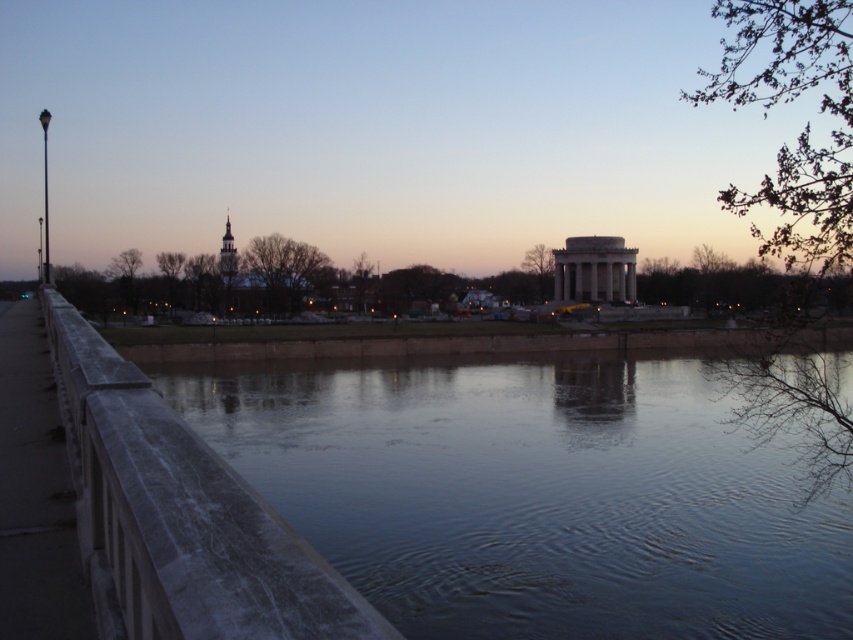
Can you confirm if smooth concrete river at center is shorter than smooth concrete railing at left?

→ No, smooth concrete river at center is not shorter than smooth concrete railing at left.

Is point (354, 454) farther from viewer compared to point (68, 316)?

Yes, it is behind point (68, 316).

You are a GUI agent. You are given a task and a screenshot of the screen. Output one action in this format:
    pyautogui.click(x=<x>, y=<y>)
    Task: Click on the smooth concrete river at center
    
    Given the screenshot: What is the action you would take?
    pyautogui.click(x=541, y=493)